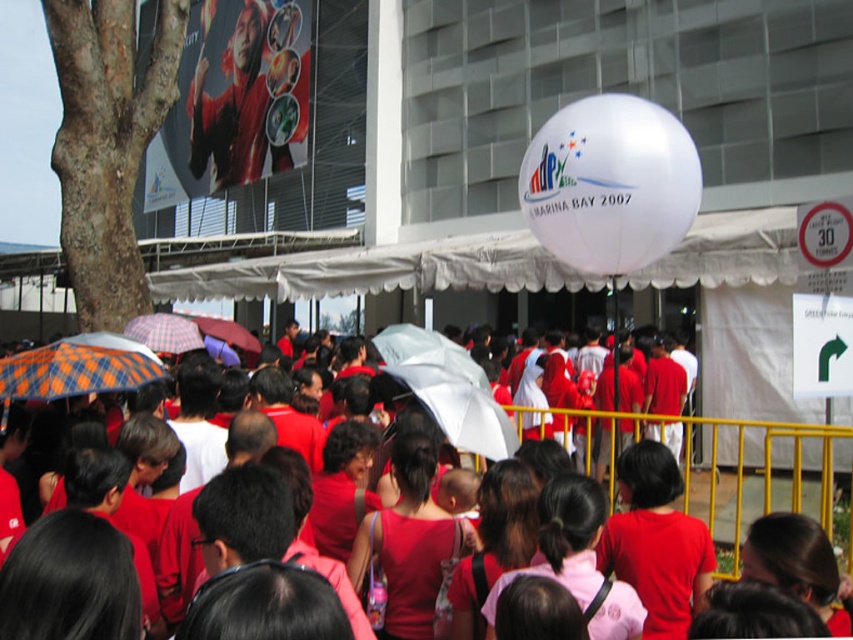
You are standing at the center of the crowd in the image and notice an orange plaid fabric umbrella at lower left. Where is the orange plaid fabric umbrella relative to your position?

The orange plaid fabric umbrella at lower left is located at point [78,368], which places it to the lower left relative to your position at the center of the crowd.

You are standing at the entrance of the event and want to locate the group wearing the matte red shirts at center. According to the coordinates provided, where should you look to find them?

The matte red shirts at center are located at coordinates point (769, 465), so you should look towards the lower right area of the image since the coordinates are closer to the bottom right corner.

You are standing at the event and want to reach the point marked as point (x=49, y=392). If you can walk 2 meters per second, how many seconds will it take you to reach that point?

The distance between you and point (x=49, y=392) is 6.51 meters. At a walking speed of 2 meters per second, it will take approximately 3.25 seconds to reach the point.